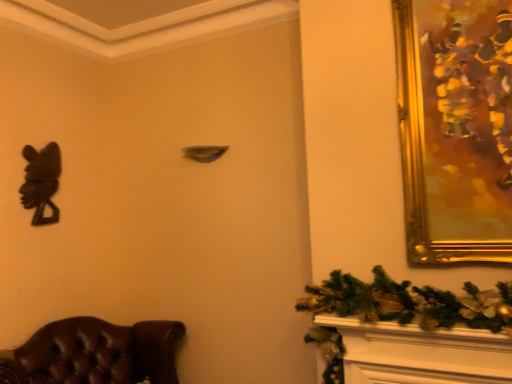
Question: Relative to black matte sculpture at left, is brown leather chair at lower left in front or behind?

Choices:
 (A) behind
 (B) front

Answer: (B)

Question: From a real-world perspective, is brown leather chair at lower left physically located above or below black matte sculpture at left?

Choices:
 (A) above
 (B) below

Answer: (B)

Question: Which is nearer to the gold/gilded picture frame at upper right?

Choices:
 (A) black matte sculpture at left
 (B) brown leather chair at lower left

Answer: (B)

Question: Based on their relative distances, which object is nearer to the brown leather chair at lower left?

Choices:
 (A) gold/gilded picture frame at upper right
 (B) black matte sculpture at left

Answer: (B)